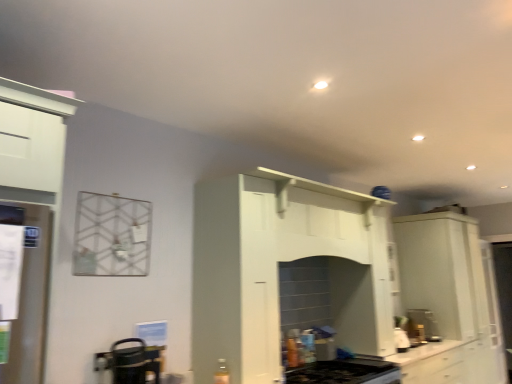
Question: Does white glossy cabinet at right have a greater height compared to white glossy refrigerator at left, acting as the 1th appliance starting from the front?

Choices:
 (A) no
 (B) yes

Answer: (B)

Question: Is white glossy cabinet at right outside of white glossy refrigerator at left, which appears as the second appliance when viewed from the back?

Choices:
 (A) no
 (B) yes

Answer: (B)

Question: Can you see white glossy cabinet at right touching white glossy refrigerator at left, which appears as the second appliance when viewed from the back?

Choices:
 (A) yes
 (B) no

Answer: (B)

Question: Is white glossy cabinet at right at the left side of white glossy refrigerator at left, positioned as the second appliance in bottom-to-top order?

Choices:
 (A) yes
 (B) no

Answer: (B)

Question: Is white glossy cabinet at right aimed at white glossy refrigerator at left, the first appliance when ordered from left to right?

Choices:
 (A) yes
 (B) no

Answer: (B)

Question: Is white glossy refrigerator at left, arranged as the second appliance when viewed from the right, taller or shorter than white glossy cabinet at right?

Choices:
 (A) short
 (B) tall

Answer: (A)

Question: Is white glossy refrigerator at left, positioned as the 1th appliance in top-to-bottom order, in front of or behind white glossy cabinet at right in the image?

Choices:
 (A) behind
 (B) front

Answer: (B)

Question: Considering the positions of white glossy refrigerator at left, which appears as the second appliance when viewed from the back, and white glossy cabinet at right in the image, is white glossy refrigerator at left, which appears as the second appliance when viewed from the back, wider or thinner than white glossy cabinet at right?

Choices:
 (A) thin
 (B) wide

Answer: (A)

Question: Is white glossy refrigerator at left, positioned as the 1th appliance in top-to-bottom order, bigger or smaller than white glossy cabinet at right?

Choices:
 (A) big
 (B) small

Answer: (B)

Question: Would you say white glossy refrigerator at left, the first appliance when ordered from left to right, is inside or outside black plastic coffee machine at lower right?

Choices:
 (A) inside
 (B) outside

Answer: (B)

Question: From a real-world perspective, relative to black plastic coffee machine at lower right, is white glossy refrigerator at left, positioned as the 1th appliance in top-to-bottom order, vertically above or below?

Choices:
 (A) below
 (B) above

Answer: (B)

Question: In the image, is white glossy refrigerator at left, arranged as the second appliance when viewed from the right, on the left side or the right side of black plastic coffee machine at lower right?

Choices:
 (A) right
 (B) left

Answer: (B)

Question: Based on their sizes in the image, would you say white glossy refrigerator at left, acting as the 1th appliance starting from the front, is bigger or smaller than black plastic coffee machine at lower right?

Choices:
 (A) big
 (B) small

Answer: (B)

Question: Considering the positions of white glossy cabinet at right and black plastic coffee machine at lower right in the image, is white glossy cabinet at right taller or shorter than black plastic coffee machine at lower right?

Choices:
 (A) short
 (B) tall

Answer: (B)

Question: From the image's perspective, relative to black plastic coffee machine at lower right, is white glossy cabinet at right above or below?

Choices:
 (A) below
 (B) above

Answer: (B)